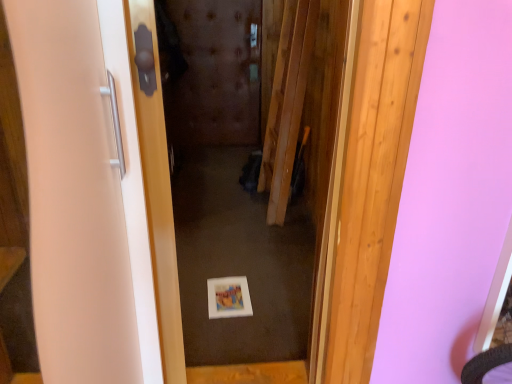
Question: Considering the relative sizes of white glossy door at center, the 2th door positioned from the left, and white glossy door handle at left, placed as the 1th door when sorted from left to right, in the image provided, is white glossy door at center, the 2th door positioned from the left, thinner than white glossy door handle at left, placed as the 1th door when sorted from left to right,?

Choices:
 (A) no
 (B) yes

Answer: (B)

Question: From a real-world perspective, is white glossy door at center, the first door positioned from the right, over white glossy door handle at left, positioned as the second door in right-to-left order?

Choices:
 (A) yes
 (B) no

Answer: (B)

Question: Does white glossy door at center, the 2th door positioned from the left, have a greater width compared to white glossy door handle at left, placed as the 1th door when sorted from left to right?

Choices:
 (A) no
 (B) yes

Answer: (A)

Question: From a real-world perspective, is white glossy door at center, the first door positioned from the right, under white glossy door handle at left, positioned as the second door in right-to-left order?

Choices:
 (A) no
 (B) yes

Answer: (B)

Question: From the image's perspective, is white glossy door at center, the first door positioned from the right, located above white glossy door handle at left, positioned as the second door in right-to-left order?

Choices:
 (A) yes
 (B) no

Answer: (B)

Question: Does white glossy door at center, the 2th door positioned from the left, appear on the left side of white glossy door handle at left, placed as the 1th door when sorted from left to right?

Choices:
 (A) no
 (B) yes

Answer: (A)

Question: Is white glossy door handle at left, placed as the 1th door when sorted from left to right, taller than white glossy door at center, the first door positioned from the right?

Choices:
 (A) yes
 (B) no

Answer: (B)

Question: From the image's perspective, would you say white glossy door handle at left, placed as the 1th door when sorted from left to right, is positioned over white glossy door at center, the first door positioned from the right?

Choices:
 (A) yes
 (B) no

Answer: (A)

Question: Does white glossy door handle at left, positioned as the second door in right-to-left order, have a smaller size compared to white glossy door at center, the first door positioned from the right?

Choices:
 (A) yes
 (B) no

Answer: (A)

Question: Would you say white glossy door handle at left, positioned as the second door in right-to-left order, is outside white glossy door at center, the first door positioned from the right?

Choices:
 (A) no
 (B) yes

Answer: (A)

Question: Is the depth of white glossy door handle at left, placed as the 1th door when sorted from left to right, less than that of white glossy door at center, the 2th door positioned from the left?

Choices:
 (A) yes
 (B) no

Answer: (A)

Question: From a real-world perspective, is white glossy door handle at left, placed as the 1th door when sorted from left to right, on top of white glossy door at center, the 2th door positioned from the left?

Choices:
 (A) no
 (B) yes

Answer: (B)

Question: Is white glossy door at center, the first door positioned from the right, taller or shorter than white glossy door handle at left, positioned as the second door in right-to-left order?

Choices:
 (A) tall
 (B) short

Answer: (A)